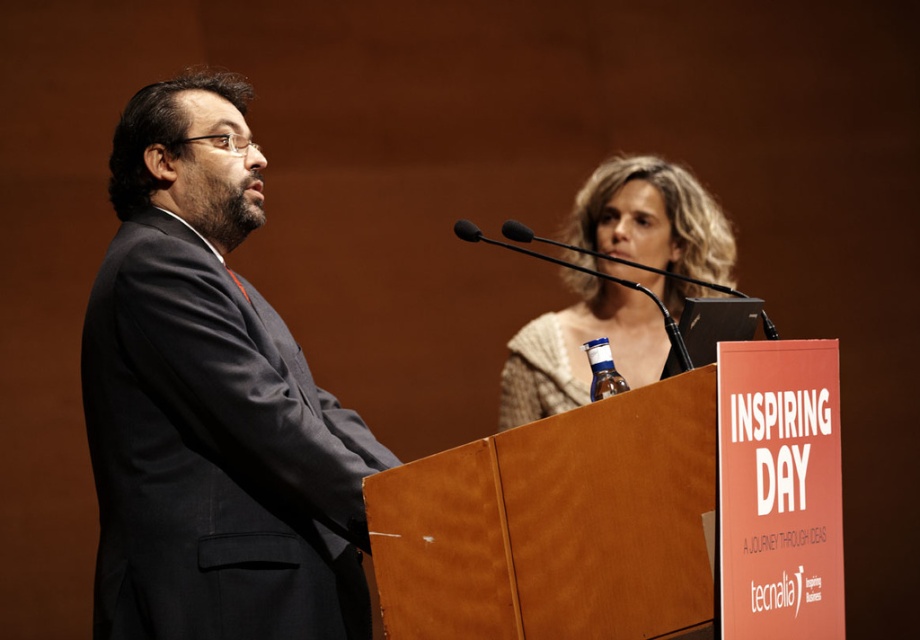
Question: Among these points, which one is farthest from the camera?

Choices:
 (A) (279, 355)
 (B) (670, 193)

Answer: (B)

Question: Can you confirm if knitted beige sweater at upper center is smaller than black matte microphone at upper center?

Choices:
 (A) yes
 (B) no

Answer: (B)

Question: Is black matte microphone at upper center below blue plastic bottle at center?

Choices:
 (A) yes
 (B) no

Answer: (B)

Question: Which point is closer to the camera taking this photo?

Choices:
 (A) (527, 324)
 (B) (613, 388)

Answer: (B)

Question: Which object is positioned farthest from the dark gray suit at left?

Choices:
 (A) knitted beige sweater at upper center
 (B) black matte microphone at upper center
 (C) blue plastic bottle at center

Answer: (A)

Question: Is knitted beige sweater at upper center smaller than blue plastic bottle at center?

Choices:
 (A) yes
 (B) no

Answer: (B)